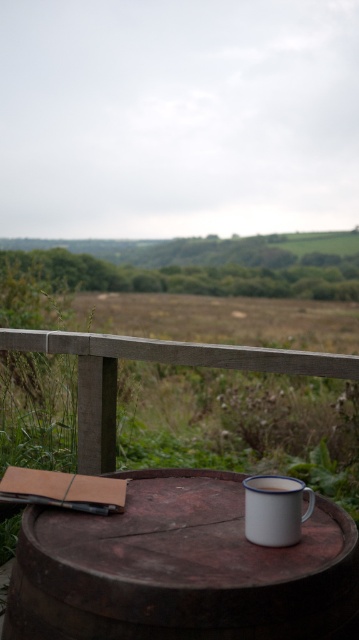
You are a painter carrying a 1.6 meter long canvas. You are standing on the wooden deck and see the rustic wooden barrel at center and the wooden rail at upper center. Can you place your canvas horizontally between them without bending it?

The distance between the rustic wooden barrel at center and the wooden rail at upper center is 1.58 meters, which is slightly shorter than your 1.6 meter canvas. Therefore, you cannot place the canvas horizontally between them without bending it.

You are standing on the wooden deck and want to place a new decorative item between the rustic wooden barrel at center and the white enamel mug at lower right. Based on their positions, which object should the new item be closer to?

The rustic wooden barrel at center is in front of the white enamel mug at lower right, so the new item should be placed closer to the white enamel mug at lower right to maintain the spatial arrangement.